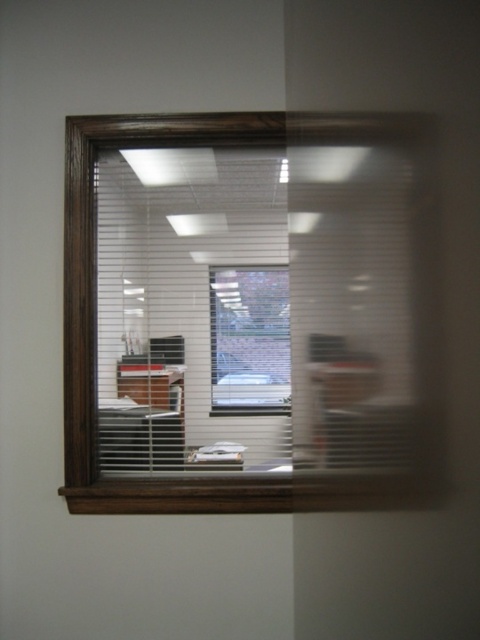
You are an interior designer planning to install a new light fixture. You notice the white matte blinds at center and the brick wall at center. Which object would you consider if you want to install a light fixture that requires a larger space?

The white matte blinds at center has a larger size compared to the brick wall at center, so you should consider the white matte blinds at center for installing the light fixture that requires a larger space.

You are an office worker who wants to check if the white matte blinds at center are positioned to the left or right side of the brick wall at center. Based on the scene, which side are they on?

The white matte blinds at center are positioned to the left of the brick wall at center.

Based on the photo, you are an office worker who wants to adjust the lighting in your workspace. You have the option to open or close the white matte blinds at center or the brick wall at center. Which object can you adjust to change the lighting?

The white matte blinds at center can be adjusted to change the lighting since they are the blinds that control light entry, while the brick wall at center is a structural element and cannot be adjusted.